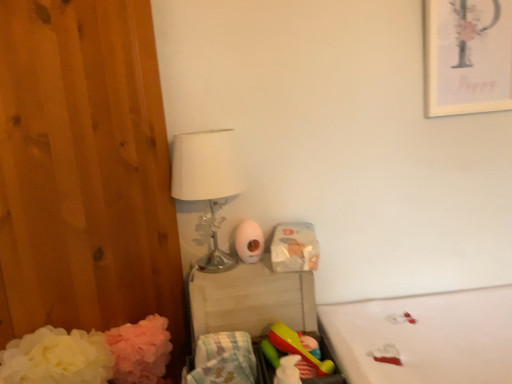
What do you see at coordinates (251, 300) in the screenshot? I see `plastic changing table at center` at bounding box center [251, 300].

What is the approximate width of pastel cotton blanket at lower center?

32.77 centimeters.

Locate an element on the screen. The height and width of the screenshot is (384, 512). white glossy toilet paper at center is located at coordinates (249, 241).

Does white glossy toilet paper at center touch matte white picture frame at upper right?

They are not placed beside each other.

From the image's perspective, who appears lower, white glossy toilet paper at center or matte white picture frame at upper right?

white glossy toilet paper at center appears lower in the image.

Based on their positions, is white glossy toilet paper at center located to the left or right of matte white picture frame at upper right?

white glossy toilet paper at center is to the left of matte white picture frame at upper right.

From a real-world perspective, is white glossy toilet paper at center physically located above or below matte white picture frame at upper right?

In terms of real-world spatial position, white glossy toilet paper at center is below matte white picture frame at upper right.

Is rubberized yellow and red toy at lower center to the left of pastel cotton blanket at lower center from the viewer's perspective?

Incorrect, rubberized yellow and red toy at lower center is not on the left side of pastel cotton blanket at lower center.

Considering the sizes of objects rubberized yellow and red toy at lower center and pastel cotton blanket at lower center in the image provided, who is bigger, rubberized yellow and red toy at lower center or pastel cotton blanket at lower center?

pastel cotton blanket at lower center is bigger.

From the picture: Is rubberized yellow and red toy at lower center looking in the opposite direction of pastel cotton blanket at lower center?

That's not correct — rubberized yellow and red toy at lower center is not looking away from pastel cotton blanket at lower center.

Does rubberized yellow and red toy at lower center come behind pastel cotton blanket at lower center?

Yes, rubberized yellow and red toy at lower center is further from the camera.

Is rubberized yellow and red toy at lower center positioned far away from white glossy toilet paper at center?

No, rubberized yellow and red toy at lower center is not far from white glossy toilet paper at center.

Which of these two, rubberized yellow and red toy at lower center or white glossy toilet paper at center, is bigger?

With larger size is rubberized yellow and red toy at lower center.

Is rubberized yellow and red toy at lower center oriented away from white glossy toilet paper at center?

No, rubberized yellow and red toy at lower center's orientation is not away from white glossy toilet paper at center.

From the image's perspective, is rubberized yellow and red toy at lower center on top of white glossy toilet paper at center?

No, from the image's perspective, rubberized yellow and red toy at lower center is not on top of white glossy toilet paper at center.

Could you tell me if matte white picture frame at upper right is turned towards rubberized yellow and red toy at lower center?

No, matte white picture frame at upper right does not turn towards rubberized yellow and red toy at lower center.

Between matte white picture frame at upper right and rubberized yellow and red toy at lower center, which one appears on the right side from the viewer's perspective?

Positioned to the right is matte white picture frame at upper right.

Considering the sizes of objects matte white picture frame at upper right and rubberized yellow and red toy at lower center in the image provided, who is wider, matte white picture frame at upper right or rubberized yellow and red toy at lower center?

With larger width is rubberized yellow and red toy at lower center.

Is matte white picture frame at upper right taller than rubberized yellow and red toy at lower center?

Yes, matte white picture frame at upper right is taller than rubberized yellow and red toy at lower center.

From the image's perspective, is white glossy toilet paper at center located above or below pastel cotton blanket at lower center?

white glossy toilet paper at center is situated higher than pastel cotton blanket at lower center in the image.

The width and height of the screenshot is (512, 384). Find the location of `toilet paper on the right of the pastel cotton blanket at lower center`. toilet paper on the right of the pastel cotton blanket at lower center is located at coordinates (249, 241).

Could you tell me if white glossy toilet paper at center is turned towards pastel cotton blanket at lower center?

No, white glossy toilet paper at center is not turned towards pastel cotton blanket at lower center.

From a real-world perspective, which object rests below the other?

From a 3D spatial view, rubberized yellow and red toy at lower center is below.

From the image's perspective, relative to matte white picture frame at upper right, is rubberized yellow and red toy at lower center above or below?

rubberized yellow and red toy at lower center is situated lower than matte white picture frame at upper right in the image.

In terms of size, does rubberized yellow and red toy at lower center appear bigger or smaller than matte white picture frame at upper right?

Considering their sizes, rubberized yellow and red toy at lower center takes up less space than matte white picture frame at upper right.

Are rubberized yellow and red toy at lower center and matte white picture frame at upper right located far from each other?

They are positioned close to each other.

Is plastic changing table at center behind rubberized yellow and red toy at lower center?

Yes, it is.

Is plastic changing table at center turned away from rubberized yellow and red toy at lower center?

plastic changing table at center is not turned away from rubberized yellow and red toy at lower center.

Who is shorter, plastic changing table at center or rubberized yellow and red toy at lower center?

rubberized yellow and red toy at lower center.

Is plastic changing table at center wider or thinner than rubberized yellow and red toy at lower center?

Clearly, plastic changing table at center has more width compared to rubberized yellow and red toy at lower center.

Where is `picture frame on the right of white glossy toilet paper at center`? This screenshot has width=512, height=384. picture frame on the right of white glossy toilet paper at center is located at coordinates (467, 56).

At what (x,y) coordinates should I click in order to perform the action: click on material on the left side of rubberized yellow and red toy at lower center. Please return your answer as a coordinate pair (x, y). The height and width of the screenshot is (384, 512). Looking at the image, I should click on (224, 359).

Which object lies nearer to the anchor point matte white picture frame at upper right, white glossy table lamp at upper left or white fabric mattress at lower right?

white fabric mattress at lower right is closer to matte white picture frame at upper right.

Looking at the image, which one is located further to white glossy toilet paper at center, matte white picture frame at upper right or white fabric mattress at lower right?

Among the two, matte white picture frame at upper right is located further to white glossy toilet paper at center.

Based on their spatial positions, is matte white picture frame at upper right or plastic changing table at center further from white glossy toilet paper at center?

matte white picture frame at upper right lies further to white glossy toilet paper at center than the other object.

Based on the photo, based on their spatial positions, is matte white picture frame at upper right or white glossy toilet paper at center closer to rubberized yellow and red toy at lower center?

Based on the image, white glossy toilet paper at center appears to be nearer to rubberized yellow and red toy at lower center.

From the image, which object appears to be nearer to rubberized yellow and red toy at lower center, matte white picture frame at upper right or pastel cotton blanket at lower center?

Based on the image, pastel cotton blanket at lower center appears to be nearer to rubberized yellow and red toy at lower center.

Which object lies nearer to the anchor point rubberized yellow and red toy at lower center, white fabric mattress at lower right or white glossy table lamp at upper left?

white fabric mattress at lower right lies closer to rubberized yellow and red toy at lower center than the other object.

When comparing their distances from white fabric mattress at lower right, does matte white picture frame at upper right or rubberized yellow and red toy at lower center seem further?

Among the two, matte white picture frame at upper right is located further to white fabric mattress at lower right.

Based on their spatial positions, is white glossy toilet paper at center or rubberized yellow and red toy at lower center further from white fabric mattress at lower right?

Among the two, white glossy toilet paper at center is located further to white fabric mattress at lower right.

Where is `table lamp between matte white picture frame at upper right and white fabric mattress at lower right vertically`? table lamp between matte white picture frame at upper right and white fabric mattress at lower right vertically is located at coordinates [207, 181].

Find the location of a particular element. toilet paper between white glossy table lamp at upper left and matte white picture frame at upper right from left to right is located at coordinates (249, 241).

Image resolution: width=512 pixels, height=384 pixels. I want to click on material between white glossy table lamp at upper left and white fabric mattress at lower right, so click(224, 359).

The height and width of the screenshot is (384, 512). Find the location of `toy between white glossy toilet paper at center and white fabric mattress at lower right from left to right`. toy between white glossy toilet paper at center and white fabric mattress at lower right from left to right is located at coordinates click(297, 347).